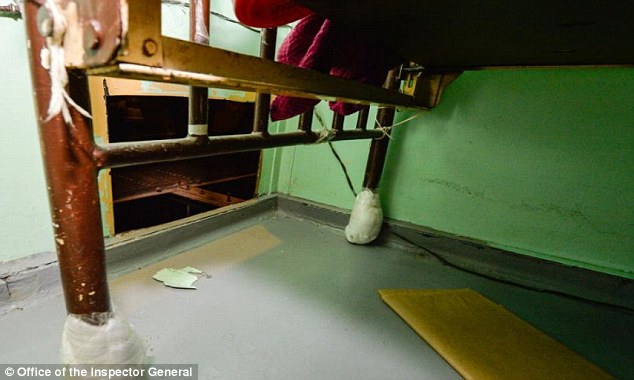
Where is `bed leg 2`? Image resolution: width=634 pixels, height=380 pixels. bed leg 2 is located at coordinates (373, 147).